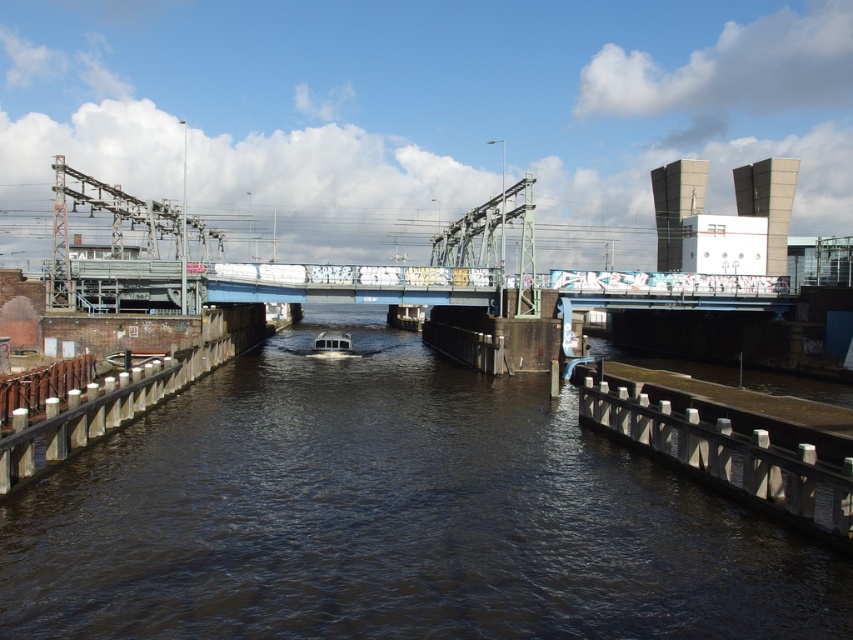
Describe the element at coordinates (392, 516) in the screenshot. Image resolution: width=853 pixels, height=640 pixels. I see `dark brown water at center` at that location.

Does point (294, 538) come farther from viewer compared to point (187, 365)?

No, (294, 538) is in front of (187, 365).

Find the location of a particular element. Image resolution: width=853 pixels, height=640 pixels. dark brown water at center is located at coordinates (392, 516).

Is metallic gray dock at lower right above wooden dock at left?

Incorrect, metallic gray dock at lower right is not positioned above wooden dock at left.

Can you confirm if metallic gray dock at lower right is positioned to the right of wooden dock at left?

Yes, metallic gray dock at lower right is to the right of wooden dock at left.

Describe the element at coordinates (726, 454) in the screenshot. I see `metallic gray dock at lower right` at that location.

Locate an element on the screen. metallic gray dock at lower right is located at coordinates (726, 454).

The height and width of the screenshot is (640, 853). Describe the element at coordinates (123, 394) in the screenshot. I see `wooden dock at left` at that location.

Who is more distant from viewer, (125, 390) or (343, 342)?

The point (343, 342) is behind.

This screenshot has width=853, height=640. Identify the location of wooden dock at left. 123,394.